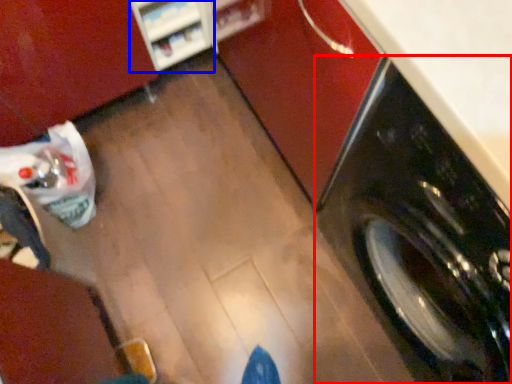
Question: Which object appears farthest to the camera in this image, washing machine (highlighted by a red box) or shelf (highlighted by a blue box)?

Choices:
 (A) washing machine
 (B) shelf

Answer: (B)